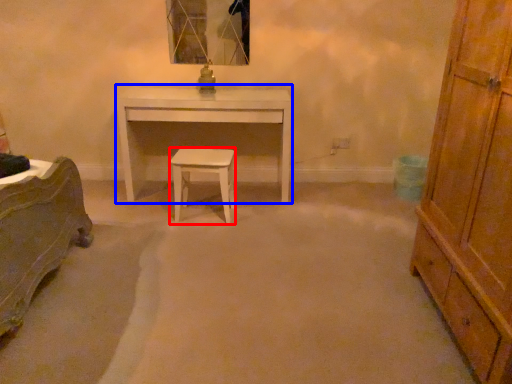
Question: Which object appears farthest to the camera in this image, stool (highlighted by a red box) or desk (highlighted by a blue box)?

Choices:
 (A) stool
 (B) desk

Answer: (B)